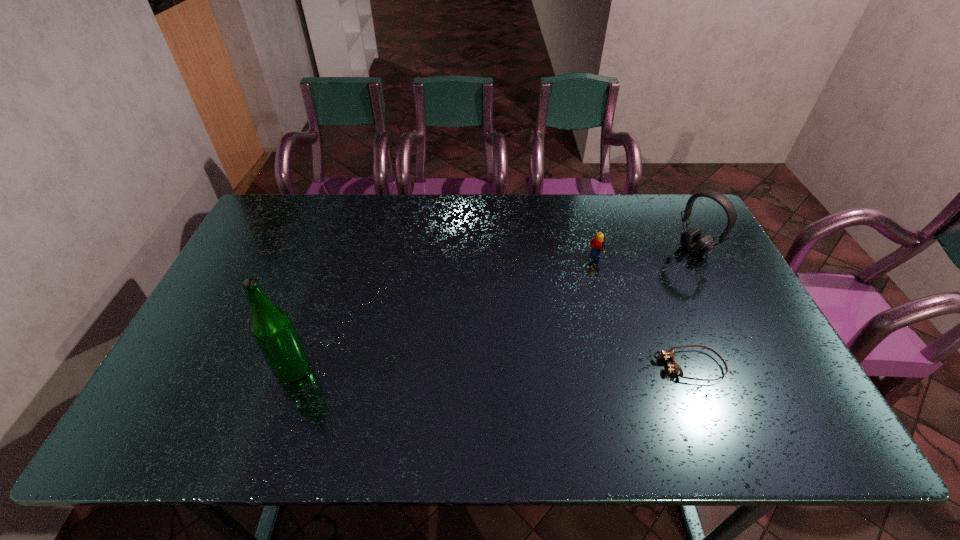
Locate an element on the screen. Image resolution: width=960 pixels, height=540 pixels. vacant space at the far right corner is located at coordinates (690, 225).

This screenshot has width=960, height=540. I want to click on free space between the rightmost object and the tallest object, so click(494, 310).

Where is `unoccupied area between the goggles and the second shortest object`? The width and height of the screenshot is (960, 540). unoccupied area between the goggles and the second shortest object is located at coordinates (642, 313).

Identify the location of free space between the headset and the third tallest object. (645, 255).

Find the location of `unoccupied position between the leftmost object and the second object from left to right`. unoccupied position between the leftmost object and the second object from left to right is located at coordinates (444, 315).

At what (x,y) coordinates should I click in order to perform the action: click on free space between the third tallest object and the second object from right to left. Please return your answer as a coordinate pair (x, y). Looking at the image, I should click on (642, 313).

This screenshot has width=960, height=540. Identify the location of unoccupied area between the second object from left to right and the tallest object. (444, 315).

Identify the location of blank region between the shortest object and the third object from right to left. (642, 313).

This screenshot has width=960, height=540. Find the location of `free area in between the headset and the Lego`. free area in between the headset and the Lego is located at coordinates (645, 255).

This screenshot has height=540, width=960. I want to click on empty space that is in between the headset and the Lego, so click(x=645, y=255).